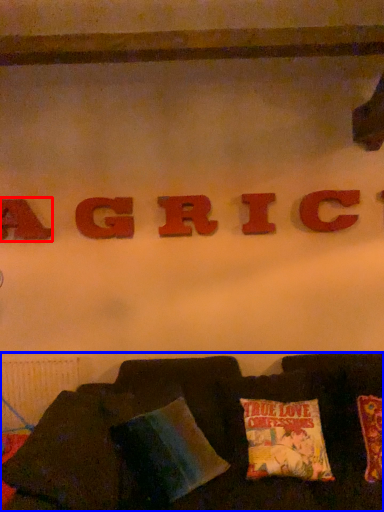
Question: Which point is closer to the camera, letter (highlighted by a red box) or furniture (highlighted by a blue box)?

Choices:
 (A) letter
 (B) furniture

Answer: (B)